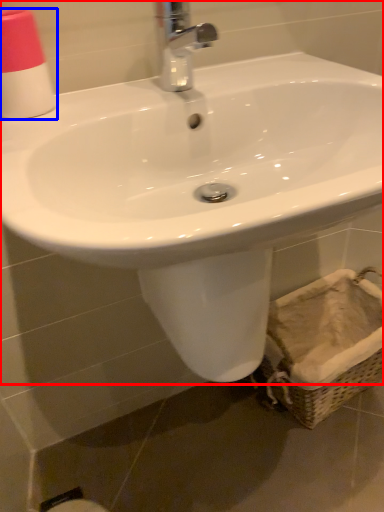
Question: Among these objects, which one is farthest to the camera, sink (highlighted by a red box) or toiletry (highlighted by a blue box)?

Choices:
 (A) sink
 (B) toiletry

Answer: (B)